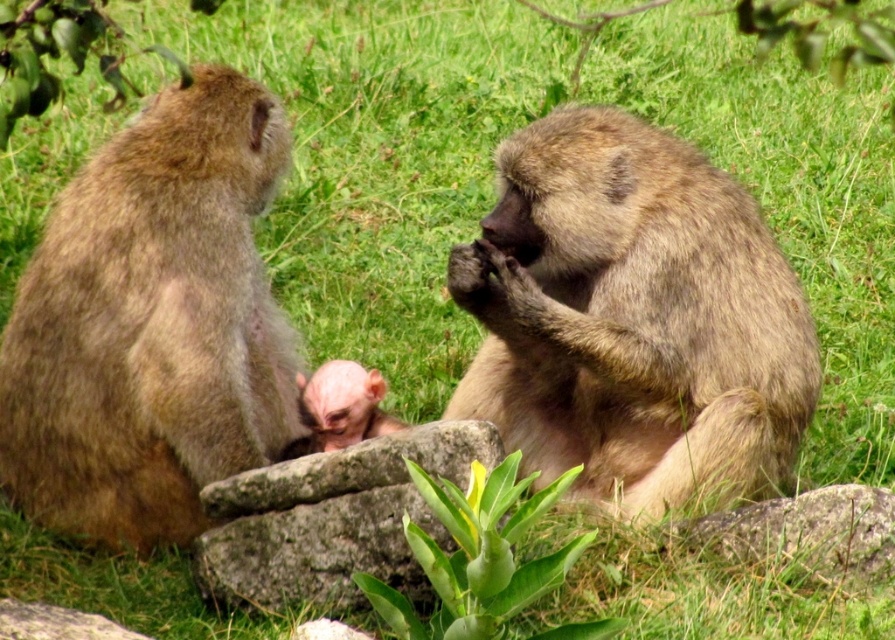
You are a wildlife photographer trying to capture a closeup shot of the brown furry monkey at left and the pink fur baby monkey at center. Your camera has a maximum focus range of 16 inches. Can you fit both monkeys in the frame without moving the camera?

The brown furry monkey at left and the pink fur baby monkey at center are 16.51 inches apart from each other. Since the distance between them exceeds the camera maximum focus range of 16 inches, you cannot fit both monkeys in the frame without moving the camera.

In the image of the baboons in the grassy area, where is the brown furry monkey at center relative to the pink fur baby monkey at center?

The brown furry monkey at center is to the right of the pink fur baby monkey at center.

You are a wildlife photographer aiming to capture a closeup of the gray stone at center and the pink fur baby monkey at center. Given that your camera can only focus on objects within a 15 cm width, will both fit in the frame if placed side by side?

The gray stone at center is wider than the pink fur baby monkey at center. However, since the total width of both together would exceed the camera focus limit of 15 cm, they cannot both fit in the frame side by side.